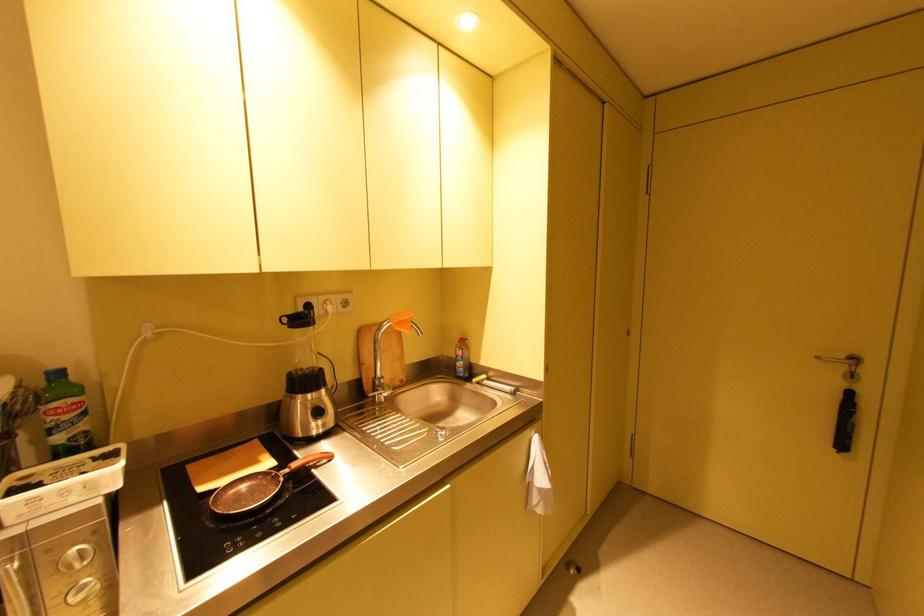
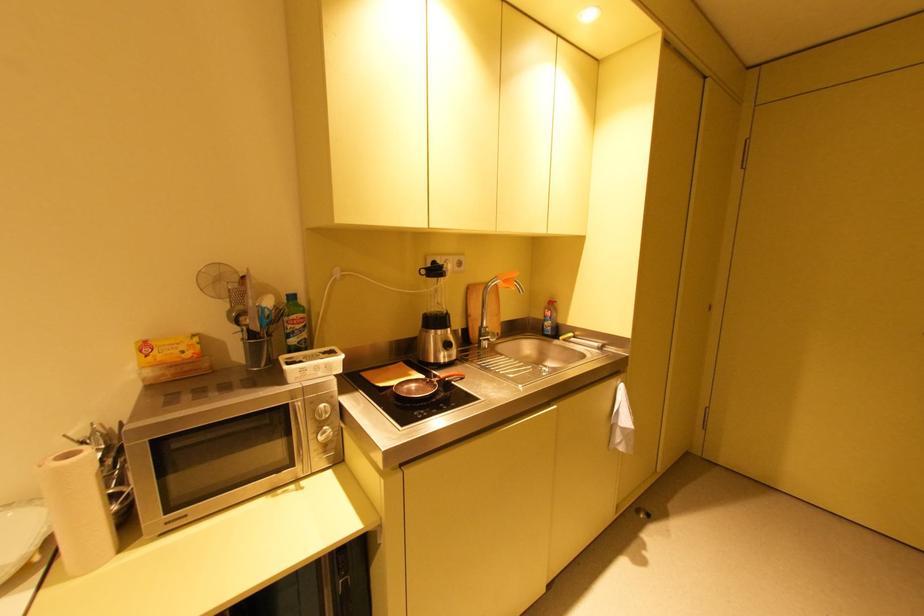
Locate, in the second image, the point that corresponds to (463,363) in the first image.

(551, 323)